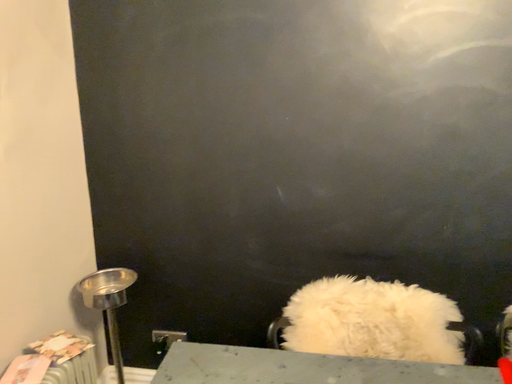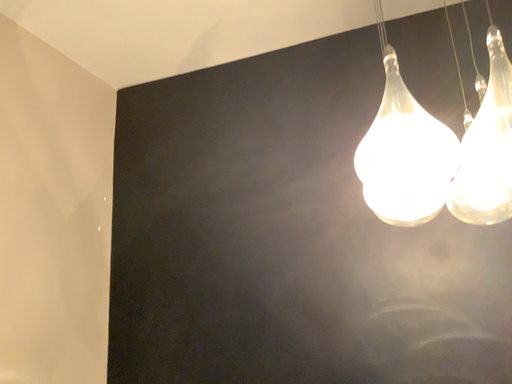
Question: Which way did the camera rotate in the video?

Choices:
 (A) rotated right
 (B) rotated left

Answer: (B)